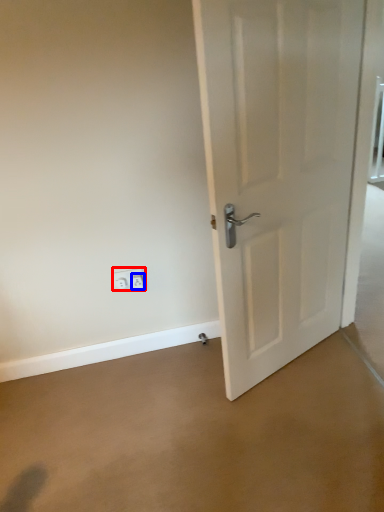
Question: Which point is closer to the camera, electric outlet (highlighted by a red box) or electric outlet (highlighted by a blue box)?

Choices:
 (A) electric outlet
 (B) electric outlet

Answer: (B)